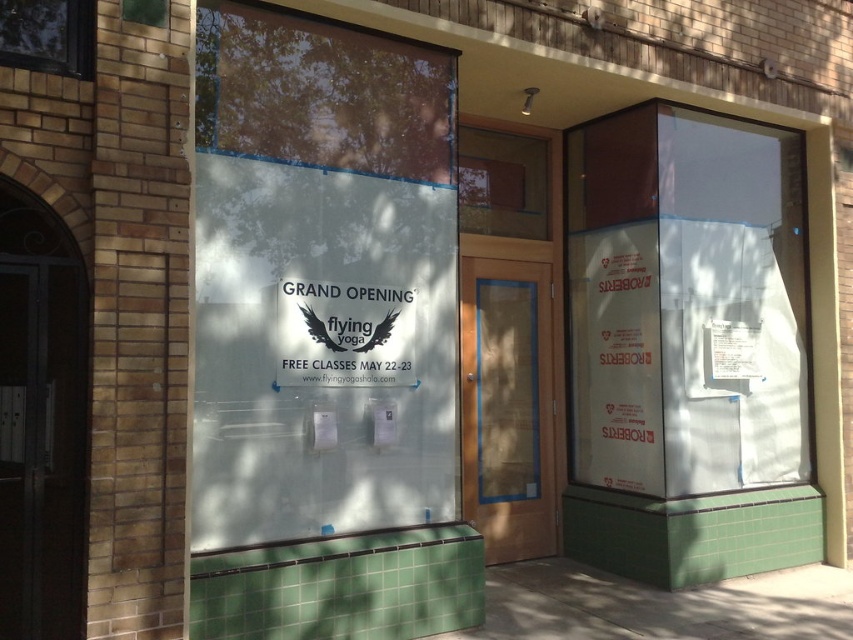
Consider the image. Can you confirm if dark wood door at left is smaller than white paper sign at center?

Yes, dark wood door at left is smaller than white paper sign at center.

Does point (49, 509) lie in front of point (297, 301)?

That is True.

The height and width of the screenshot is (640, 853). In order to click on dark wood door at left in this screenshot , I will do `click(41, 420)`.

Who is shorter, transparent glass sign at center or clear glass door at center?

With less height is clear glass door at center.

This screenshot has height=640, width=853. What do you see at coordinates (320, 280) in the screenshot?
I see `transparent glass sign at center` at bounding box center [320, 280].

In order to click on transparent glass sign at center in this screenshot , I will do `click(320, 280)`.

Is transparent glass sign at center wider than clear glass window at upper left?

Yes.

Between point (412, 225) and point (1, 36), which one is positioned in front?

Point (1, 36) is in front.

I want to click on transparent glass sign at center, so click(x=320, y=280).